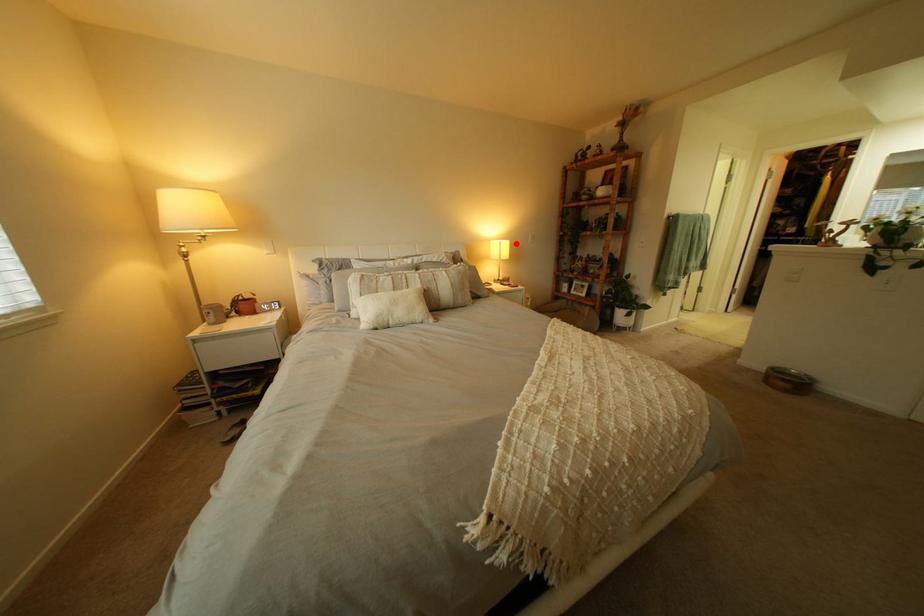
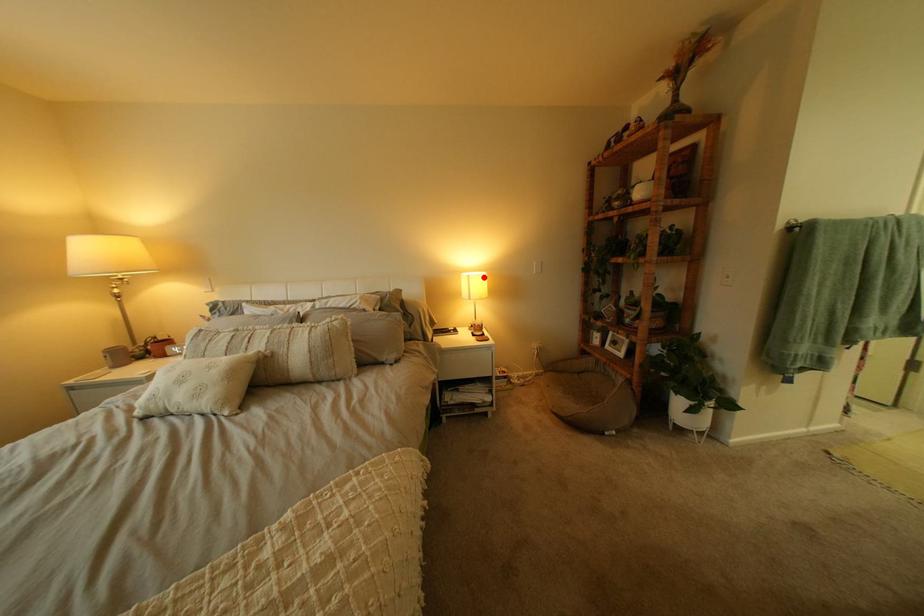
I am providing you with two images of the same scene from different viewpoints. A red point is marked on the first image and another point is marked on the second image. Is the marked point in image1 the same physical position as the marked point in image2?

Yes